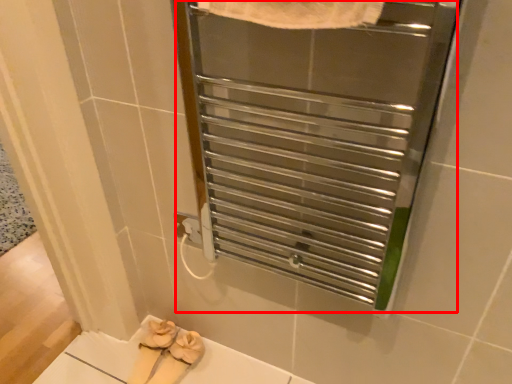
Question: Where is screen door (annotated by the red box) located in relation to footwear in the image?

Choices:
 (A) right
 (B) left

Answer: (A)